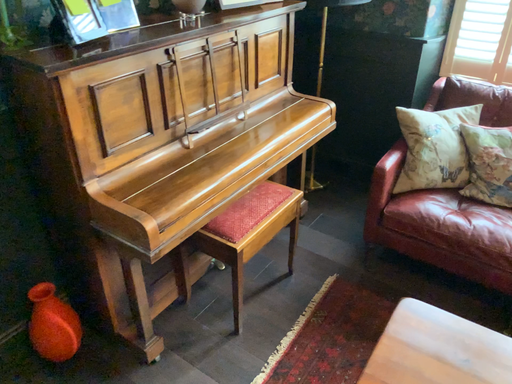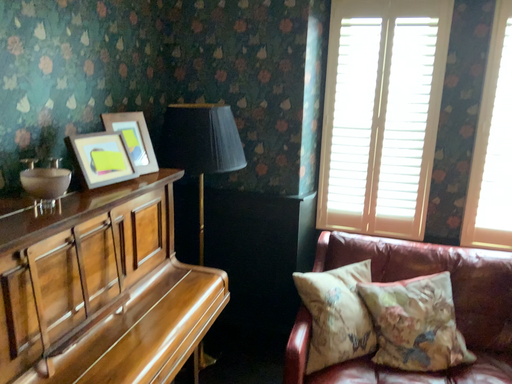
Question: Which way did the camera rotate in the video?

Choices:
 (A) rotated left
 (B) rotated right

Answer: (B)